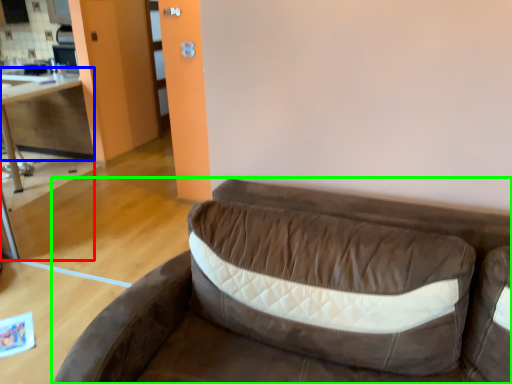
Question: Based on their relative distances, which object is nearer to table (highlighted by a red box)? Choose from cabinetry (highlighted by a blue box) and studio couch (highlighted by a green box).

Choices:
 (A) cabinetry
 (B) studio couch

Answer: (A)